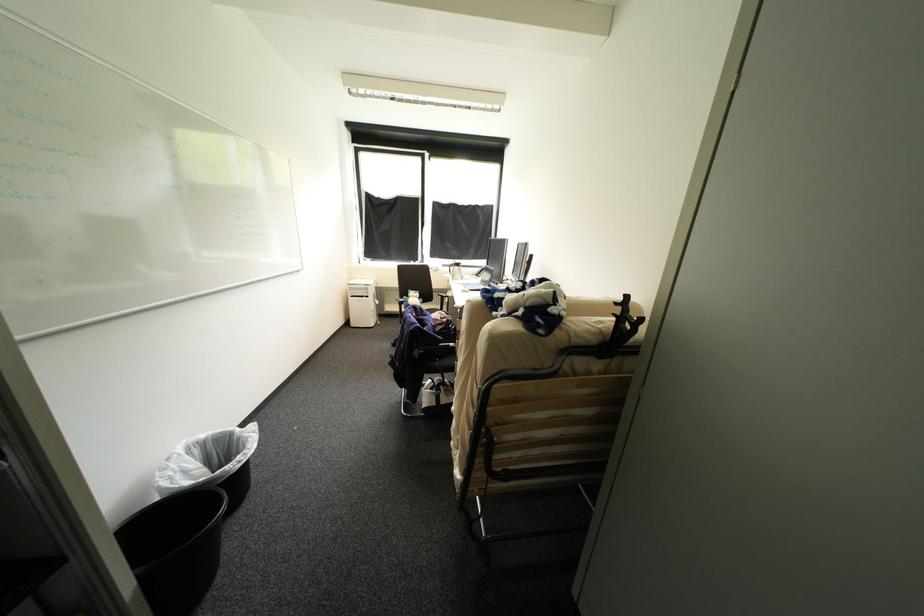
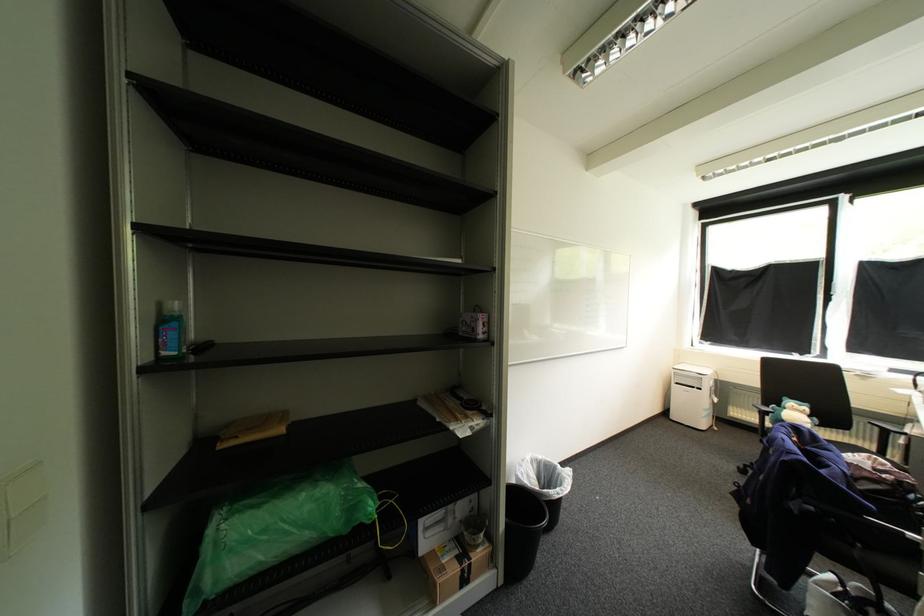
Locate, in the second image, the point that corresponds to point (448, 328) in the first image.

(885, 488)